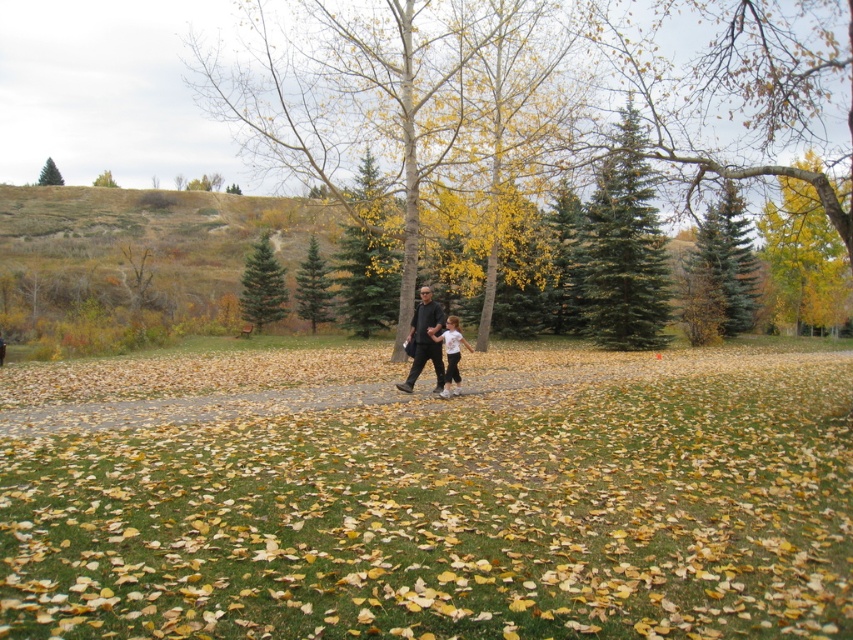
Question: Which point is closer to the camera taking this photo?

Choices:
 (A) (403, 342)
 (B) (447, 360)
 (C) (251, 280)
 (D) (48, 177)

Answer: (B)

Question: Is matte black clothing at center wider than green matte tree at upper left?

Choices:
 (A) yes
 (B) no

Answer: (B)

Question: Can you confirm if green matte tree at center is positioned to the right of green matte tree at upper left?

Choices:
 (A) yes
 (B) no

Answer: (A)

Question: Among these points, which one is farthest from the camera?

Choices:
 (A) (614, 285)
 (B) (321, 269)

Answer: (B)

Question: Does green fir tree at center lie in front of green leafy tree at upper center?

Choices:
 (A) yes
 (B) no

Answer: (A)

Question: Among these objects, which one is farthest from the camera?

Choices:
 (A) green matte tree at center
 (B) white matte shirt at center
 (C) green matte tree at upper left
 (D) green fir tree at center

Answer: (C)